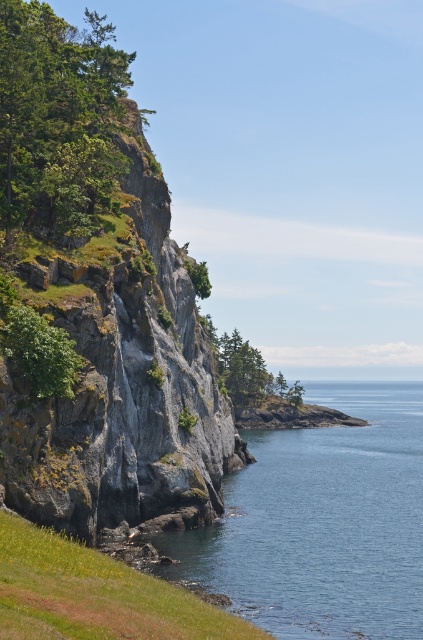
Question: Is green rough rock at left to the left of green leafy tree at lower left from the viewer's perspective?

Choices:
 (A) no
 (B) yes

Answer: (B)

Question: Is clear blue water at center further to the viewer compared to green grassy at lower left?

Choices:
 (A) yes
 (B) no

Answer: (A)

Question: Which point appears closest to the camera in this image?

Choices:
 (A) (43, 70)
 (B) (249, 509)
 (C) (62, 342)
 (D) (2, 628)

Answer: (D)

Question: Estimate the real-world distances between objects in this image. Which object is farther from the clear blue water at center?

Choices:
 (A) green leafy tree at lower left
 (B) green rough rock at left

Answer: (B)

Question: Which point is farther to the camera?

Choices:
 (A) green rough rock at left
 (B) green leafy tree at lower left
 (C) clear blue water at center
 (D) green grassy at lower left

Answer: (A)

Question: Does green grassy at lower left have a lesser width compared to green leafy tree at lower left?

Choices:
 (A) no
 (B) yes

Answer: (A)